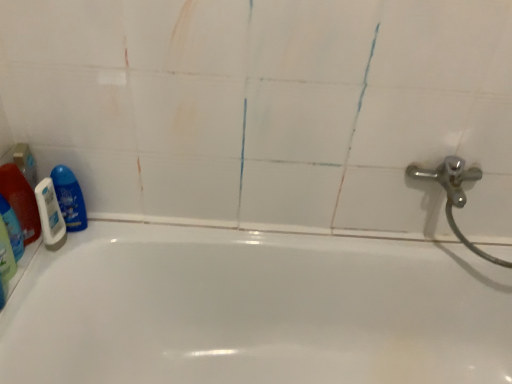
What is the approximate height of white glossy bathtub at center?

white glossy bathtub at center is 21.28 inches tall.

Describe the element at coordinates (50, 215) in the screenshot. Image resolution: width=512 pixels, height=384 pixels. I see `white matte shaving cream at left` at that location.

What is the approximate width of translucent plastic bottle at left, the 1th cleaning product from the left?

1.96 inches.

What are the coordinates of `white glossy bathtub at center` in the screenshot? It's located at (255, 310).

Which of these two, blue glossy bottle at left, which is the first cleaning product from right to left, or translucent plastic bottle at left, which appears as the 2th cleaning product when viewed from the right, stands taller?

translucent plastic bottle at left, which appears as the 2th cleaning product when viewed from the right.

Is translucent plastic bottle at left, which appears as the 2th cleaning product when viewed from the right, surrounded by blue glossy bottle at left, which ranks as the third cleaning product in left-to-right order?

No, translucent plastic bottle at left, which appears as the 2th cleaning product when viewed from the right, is not inside blue glossy bottle at left, which ranks as the third cleaning product in left-to-right order.

Between blue glossy bottle at left, which ranks as the third cleaning product in left-to-right order, and translucent plastic bottle at left, which appears as the 2th cleaning product when viewed from the right, which one appears on the right side from the viewer's perspective?

Positioned to the right is blue glossy bottle at left, which ranks as the third cleaning product in left-to-right order.

In the image, is blue glossy bottle at left, which ranks as the third cleaning product in left-to-right order, positioned in front of or behind translucent plastic bottle at left, which appears as the 2th cleaning product when viewed from the right?

Clearly, blue glossy bottle at left, which ranks as the third cleaning product in left-to-right order, is behind translucent plastic bottle at left, which appears as the 2th cleaning product when viewed from the right.

In terms of height, does translucent plastic bottle at left, which appears as the 2th cleaning product when viewed from the right, look taller or shorter compared to blue glossy bottle at left, which ranks as the third cleaning product in left-to-right order?

In the image, translucent plastic bottle at left, which appears as the 2th cleaning product when viewed from the right, appears to be taller than blue glossy bottle at left, which ranks as the third cleaning product in left-to-right order.

From the image's perspective, would you say translucent plastic bottle at left, which appears as the 2th cleaning product when viewed from the right, is positioned over blue glossy bottle at left, which is the first cleaning product from right to left?

Actually, translucent plastic bottle at left, which appears as the 2th cleaning product when viewed from the right, appears below blue glossy bottle at left, which is the first cleaning product from right to left, in the image.

Is translucent plastic bottle at left, which appears as the 2th cleaning product when viewed from the right, located outside blue glossy bottle at left, which ranks as the third cleaning product in left-to-right order?

translucent plastic bottle at left, which appears as the 2th cleaning product when viewed from the right, is positioned outside blue glossy bottle at left, which ranks as the third cleaning product in left-to-right order.

Does point (36, 230) appear closer or farther from the camera than point (71, 224)?

Point (36, 230) appears to be closer to the viewer than point (71, 224).

From a real-world perspective, is blue glossy bottle at left, which ranks as the third cleaning product in left-to-right order, located higher than white matte shaving cream at left?

No, from a real-world perspective, blue glossy bottle at left, which ranks as the third cleaning product in left-to-right order, is not on top of white matte shaving cream at left.

Which object is thinner, blue glossy bottle at left, which is the first cleaning product from right to left, or white matte shaving cream at left?

Thinner between the two is white matte shaving cream at left.

How different are the orientations of blue glossy bottle at left, which ranks as the third cleaning product in left-to-right order, and white matte shaving cream at left in degrees?

61.3 degrees separate the facing orientations of blue glossy bottle at left, which ranks as the third cleaning product in left-to-right order, and white matte shaving cream at left.

Looking at the image, does blue glossy bottle at left, which is the first cleaning product from right to left, seem bigger or smaller compared to white matte shaving cream at left?

Considering their sizes, blue glossy bottle at left, which is the first cleaning product from right to left, takes up more space than white matte shaving cream at left.

Does white matte shaving cream at left turn towards translucent plastic bottle at left, the 1th cleaning product from the left?

No, white matte shaving cream at left is not oriented towards translucent plastic bottle at left, the 1th cleaning product from the left.

Locate an element on the screen. shaving cream above the translucent plastic bottle at left, the 1th cleaning product from the left (from the image's perspective) is located at coordinates (50, 215).

Is white matte shaving cream at left bigger or smaller than translucent plastic bottle at left, placed as the 3th cleaning product when sorted from right to left?

Clearly, white matte shaving cream at left is larger in size than translucent plastic bottle at left, placed as the 3th cleaning product when sorted from right to left.

Can you confirm if white matte shaving cream at left is positioned to the left of blue glossy bottle at left, which ranks as the third cleaning product in left-to-right order?

Yes.

Looking at this image, from a real-world perspective, which object stands above the other?

In real-world perspective, white matte shaving cream at left is above.

Is white matte shaving cream at left thinner than blue glossy bottle at left, which is the first cleaning product from right to left?

Yes, white matte shaving cream at left is thinner than blue glossy bottle at left, which is the first cleaning product from right to left.

Which object is more forward, translucent plastic bottle at left, the 1th cleaning product from the left, or translucent plastic bottle at left, positioned as the second cleaning product in left-to-right order?

translucent plastic bottle at left, the 1th cleaning product from the left.

Is point (18, 251) farther from viewer compared to point (25, 219)?

That is False.

Is translucent plastic bottle at left, placed as the 3th cleaning product when sorted from right to left, in contact with translucent plastic bottle at left, which appears as the 2th cleaning product when viewed from the right?

Yes, translucent plastic bottle at left, placed as the 3th cleaning product when sorted from right to left, is with translucent plastic bottle at left, which appears as the 2th cleaning product when viewed from the right.

From the image's perspective, is translucent plastic bottle at left, the 1th cleaning product from the left, beneath translucent plastic bottle at left, positioned as the second cleaning product in left-to-right order?

Correct, translucent plastic bottle at left, the 1th cleaning product from the left, appears lower than translucent plastic bottle at left, positioned as the second cleaning product in left-to-right order, in the image.

Considering the relative sizes of white glossy bathtub at center and translucent plastic bottle at left, the 1th cleaning product from the left, in the image provided, is white glossy bathtub at center bigger than translucent plastic bottle at left, the 1th cleaning product from the left,?

Yes.

Is translucent plastic bottle at left, the 1th cleaning product from the left, located within white glossy bathtub at center?

No.

Is white glossy bathtub at center not near translucent plastic bottle at left, placed as the 3th cleaning product when sorted from right to left?

No, white glossy bathtub at center is not far away from translucent plastic bottle at left, placed as the 3th cleaning product when sorted from right to left.

Does white glossy bathtub at center have a lesser height compared to translucent plastic bottle at left, placed as the 3th cleaning product when sorted from right to left?

Incorrect, the height of white glossy bathtub at center does not fall short of that of translucent plastic bottle at left, placed as the 3th cleaning product when sorted from right to left.

The image size is (512, 384). In order to click on cleaning product behind the translucent plastic bottle at left, positioned as the second cleaning product in left-to-right order in this screenshot , I will do tap(69, 198).

Locate an element on the screen. the 1st cleaning product to the left when counting from the blue glossy bottle at left, which ranks as the third cleaning product in left-to-right order is located at coordinates (21, 201).

Considering their positions, is white glossy bathtub at center positioned closer to translucent plastic bottle at left, positioned as the second cleaning product in left-to-right order, than translucent plastic bottle at left, the 1th cleaning product from the left?

translucent plastic bottle at left, the 1th cleaning product from the left, is closer to translucent plastic bottle at left, positioned as the second cleaning product in left-to-right order.

Estimate the real-world distances between objects in this image. Which object is further from translucent plastic bottle at left, the 1th cleaning product from the left, blue glossy bottle at left, which ranks as the third cleaning product in left-to-right order, or translucent plastic bottle at left, positioned as the second cleaning product in left-to-right order?

Among the two, blue glossy bottle at left, which ranks as the third cleaning product in left-to-right order, is located further to translucent plastic bottle at left, the 1th cleaning product from the left.

When comparing their distances from translucent plastic bottle at left, the 1th cleaning product from the left, does blue glossy bottle at left, which ranks as the third cleaning product in left-to-right order, or white glossy bathtub at center seem closer?

blue glossy bottle at left, which ranks as the third cleaning product in left-to-right order, is positioned closer to the anchor translucent plastic bottle at left, the 1th cleaning product from the left.

Considering their positions, is translucent plastic bottle at left, positioned as the second cleaning product in left-to-right order, positioned further to blue glossy bottle at left, which is the first cleaning product from right to left, than white matte shaving cream at left?

translucent plastic bottle at left, positioned as the second cleaning product in left-to-right order, is further to blue glossy bottle at left, which is the first cleaning product from right to left.

Looking at the image, which one is located closer to white glossy bathtub at center, white matte shaving cream at left or blue glossy bottle at left, which ranks as the third cleaning product in left-to-right order?

Among the two, blue glossy bottle at left, which ranks as the third cleaning product in left-to-right order, is located nearer to white glossy bathtub at center.

When comparing their distances from blue glossy bottle at left, which ranks as the third cleaning product in left-to-right order, does white matte shaving cream at left or translucent plastic bottle at left, positioned as the second cleaning product in left-to-right order, seem closer?

white matte shaving cream at left lies closer to blue glossy bottle at left, which ranks as the third cleaning product in left-to-right order, than the other object.

When comparing their distances from white glossy bathtub at center, does translucent plastic bottle at left, placed as the 3th cleaning product when sorted from right to left, or white matte shaving cream at left seem closer?

white matte shaving cream at left.

Which object lies further to the anchor point white matte shaving cream at left, translucent plastic bottle at left, the 1th cleaning product from the left, or translucent plastic bottle at left, positioned as the second cleaning product in left-to-right order?

translucent plastic bottle at left, the 1th cleaning product from the left, lies further to white matte shaving cream at left than the other object.

Image resolution: width=512 pixels, height=384 pixels. Identify the location of shaving cream situated between translucent plastic bottle at left, which appears as the 2th cleaning product when viewed from the right, and white glossy bathtub at center from left to right. (50, 215).

The height and width of the screenshot is (384, 512). I want to click on shaving cream between translucent plastic bottle at left, the 1th cleaning product from the left, and white glossy bathtub at center, so click(x=50, y=215).

This screenshot has height=384, width=512. I want to click on cleaning product between translucent plastic bottle at left, positioned as the second cleaning product in left-to-right order, and white glossy bathtub at center from left to right, so click(69, 198).

Identify the location of shaving cream situated between translucent plastic bottle at left, which appears as the 2th cleaning product when viewed from the right, and blue glossy bottle at left, which is the first cleaning product from right to left, from left to right. The width and height of the screenshot is (512, 384). (50, 215).